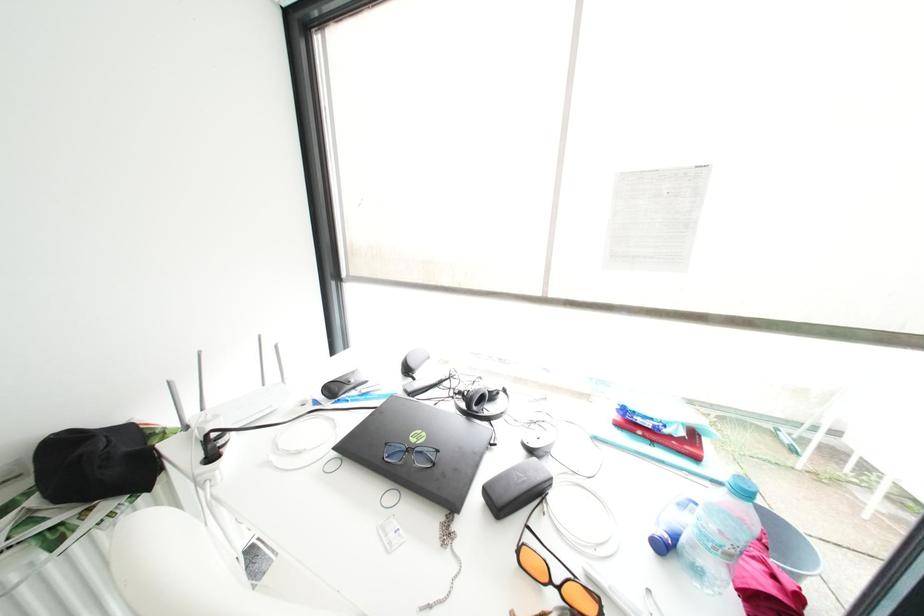
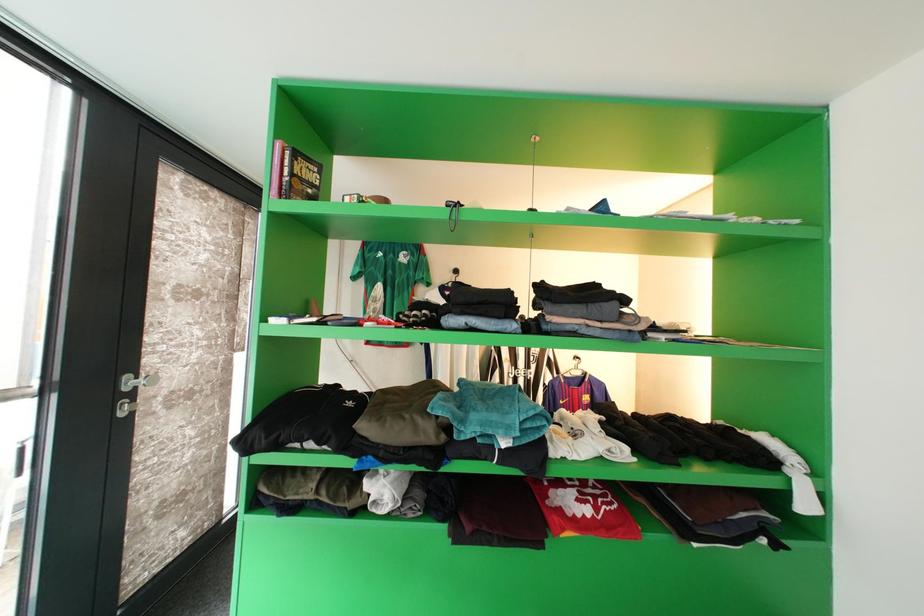
Question: The first image is from the beginning of the video and the second image is from the end. How did the camera likely rotate when shooting the video?

Choices:
 (A) Left
 (B) Right
 (C) Up
 (D) Down

Answer: (B)